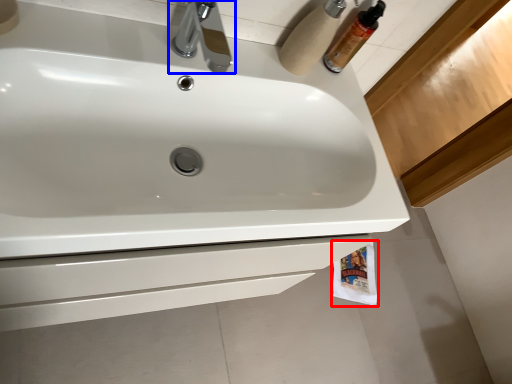
Question: Which point is closer to the camera, toilet paper (highlighted by a red box) or tap (highlighted by a blue box)?

Choices:
 (A) toilet paper
 (B) tap

Answer: (B)